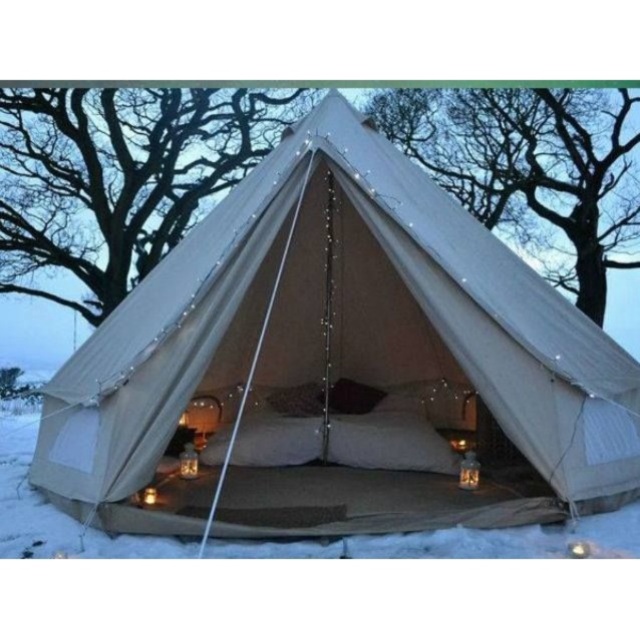
Question: Which of the following is the closest to the observer?

Choices:
 (A) beige canvas tent at center
 (B) white soft snow at center

Answer: (B)

Question: Observing the image, what is the correct spatial positioning of beige canvas tent at center in reference to white soft snow at center?

Choices:
 (A) above
 (B) below

Answer: (A)

Question: Which point is closer to the camera?

Choices:
 (A) (552, 426)
 (B) (19, 422)

Answer: (A)

Question: Is beige canvas tent at center to the right of white soft snow at center from the viewer's perspective?

Choices:
 (A) no
 (B) yes

Answer: (B)

Question: Does beige canvas tent at center have a lesser width compared to white soft snow at center?

Choices:
 (A) no
 (B) yes

Answer: (B)